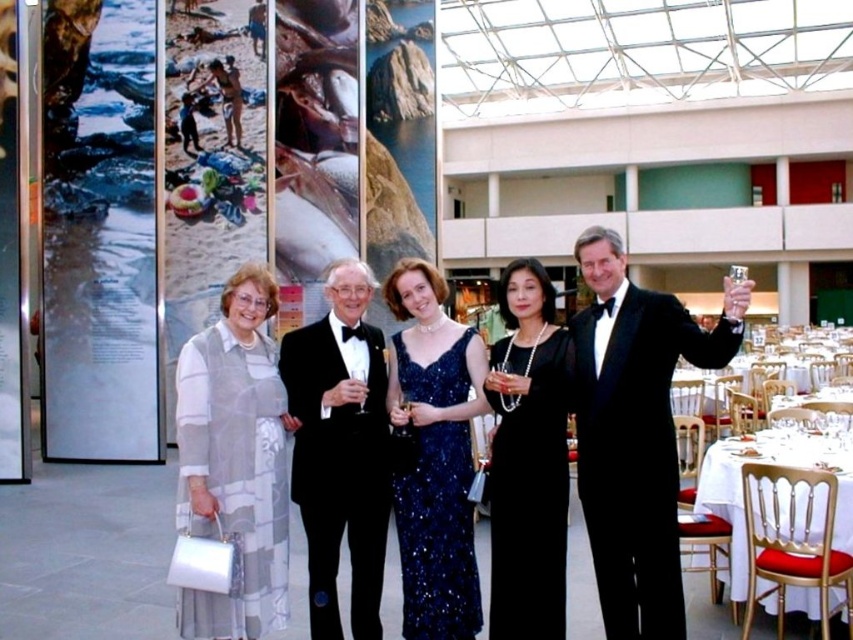
You are a photographer at the event and need to adjust the camera focus. The black velvet tuxedo at right and the black satin tuxedo at center are both in the frame. Which tuxedo should you focus on if you want to capture the one that is taller?

The black velvet tuxedo at right is taller than the black satin tuxedo at center, so focus on the black velvet tuxedo at right to capture the taller one.

You are organizing a charity gala and need to seat two guests wearing the black velvet tuxedo at right and the black satin tuxedo at center. If the table has limited space, which guest should you seat closer to the table to ensure their clothing doesn

The black satin tuxedo at center should be seated closer to the table since it is smaller in size compared to the black velvet tuxedo at right, which is larger and may require more space.

You are a photographer at the event and need to adjust the camera focus. Which person, the one wearing the black velvet tuxedo at right or the black satin dress at center, should you focus on first to ensure they are in the foreground?

The black velvet tuxedo at right is taller than the black satin dress at center, so focusing on the black velvet tuxedo at right first would place them in the foreground as they are closer to the camera.